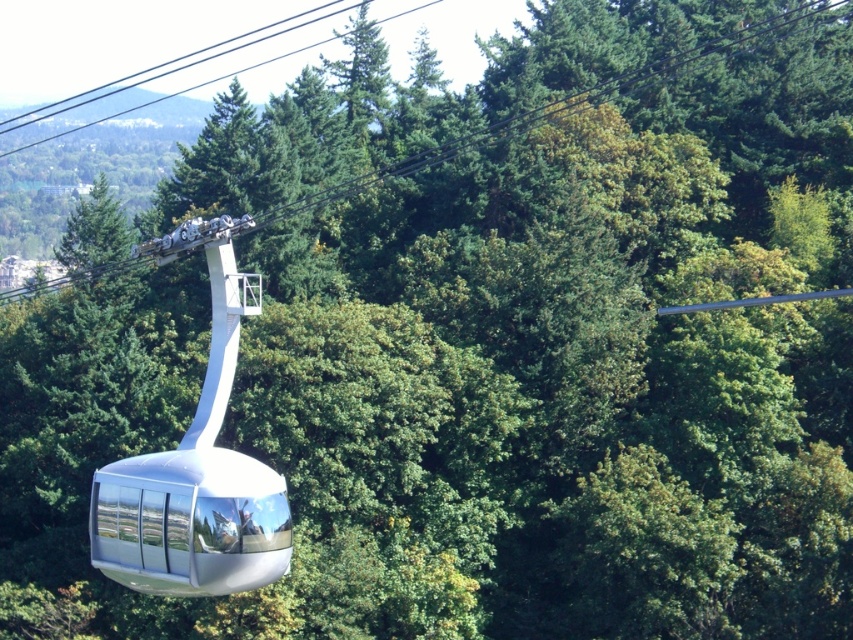
Question: Among these points, which one is farthest from the camera?

Choices:
 (A) (544, 20)
 (B) (206, 83)
 (C) (230, 292)

Answer: (B)

Question: Is the position of polished silver gondola at center more distant than that of black wire at upper center?

Choices:
 (A) no
 (B) yes

Answer: (A)

Question: Is black cable at upper center closer to camera compared to black wire at upper center?

Choices:
 (A) no
 (B) yes

Answer: (B)

Question: Which is nearer to the black wire at upper center?

Choices:
 (A) polished silver gondola at center
 (B) black cable at upper center

Answer: (B)

Question: Which point is closer to the camera taking this photo?

Choices:
 (A) (183, 584)
 (B) (166, 93)

Answer: (A)

Question: Does black cable at upper center have a lesser width compared to polished silver gondola at center?

Choices:
 (A) yes
 (B) no

Answer: (B)